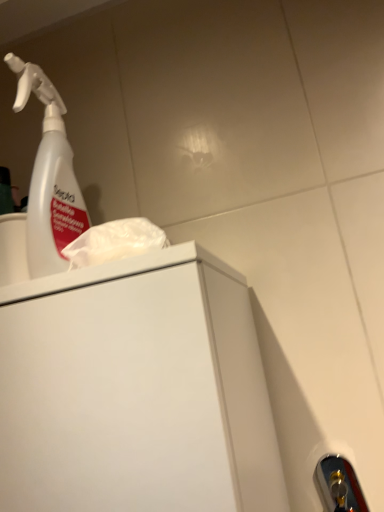
I want to click on gold metallic door handle at lower right, so click(339, 485).

What is the approximate height of gold metallic door handle at lower right?

gold metallic door handle at lower right is 7.75 inches tall.

What do you see at coordinates (339, 485) in the screenshot?
I see `gold metallic door handle at lower right` at bounding box center [339, 485].

What do you see at coordinates (49, 177) in the screenshot?
I see `transparent plastic spray bottle at upper left` at bounding box center [49, 177].

This screenshot has height=512, width=384. In order to click on transparent plastic spray bottle at upper left in this screenshot , I will do `click(49, 177)`.

The height and width of the screenshot is (512, 384). Find the location of `gold metallic door handle at lower right`. gold metallic door handle at lower right is located at coordinates (339, 485).

Would you say gold metallic door handle at lower right is to the left or to the right of transparent plastic spray bottle at upper left in the picture?

gold metallic door handle at lower right is to the right of transparent plastic spray bottle at upper left.

Is gold metallic door handle at lower right further to the viewer compared to transparent plastic spray bottle at upper left?

Yes, it is.

Is point (347, 511) closer to camera compared to point (49, 250)?

No, (347, 511) is behind (49, 250).

From the image's perspective, is gold metallic door handle at lower right located beneath transparent plastic spray bottle at upper left?

Yes.

From a real-world perspective, who is located lower, gold metallic door handle at lower right or transparent plastic spray bottle at upper left?

gold metallic door handle at lower right.

Can you confirm if gold metallic door handle at lower right is thinner than transparent plastic spray bottle at upper left?

Correct, the width of gold metallic door handle at lower right is less than that of transparent plastic spray bottle at upper left.

Looking at this image, who is taller, gold metallic door handle at lower right or transparent plastic spray bottle at upper left?

transparent plastic spray bottle at upper left is taller.

Considering the relative sizes of gold metallic door handle at lower right and transparent plastic spray bottle at upper left in the image provided, is gold metallic door handle at lower right smaller than transparent plastic spray bottle at upper left?

Yes.

Consider the image. Is gold metallic door handle at lower right completely or partially outside of transparent plastic spray bottle at upper left?

Yes.

Is gold metallic door handle at lower right touching transparent plastic spray bottle at upper left?

No, gold metallic door handle at lower right is not touching transparent plastic spray bottle at upper left.

Is gold metallic door handle at lower right facing towards transparent plastic spray bottle at upper left?

No, gold metallic door handle at lower right is not oriented towards transparent plastic spray bottle at upper left.

How different are the orientations of gold metallic door handle at lower right and transparent plastic spray bottle at upper left in degrees?

There is a 0.0015-degree angle between the facing directions of gold metallic door handle at lower right and transparent plastic spray bottle at upper left.

How far apart are gold metallic door handle at lower right and transparent plastic spray bottle at upper left?

They are 21.81 inches apart.

At what (x,y) coordinates should I click in order to perform the action: click on door handle lying below the transparent plastic spray bottle at upper left (from the image's perspective). Please return your answer as a coordinate pair (x, y). Image resolution: width=384 pixels, height=512 pixels. Looking at the image, I should click on (339, 485).

Is transparent plastic spray bottle at upper left to the right of gold metallic door handle at lower right from the viewer's perspective?

In fact, transparent plastic spray bottle at upper left is to the left of gold metallic door handle at lower right.

Which object is closer to the camera taking this photo, transparent plastic spray bottle at upper left or gold metallic door handle at lower right?

transparent plastic spray bottle at upper left is closer to the camera.

Does point (32, 183) appear closer or farther from the camera than point (319, 467)?

Point (32, 183) is closer to the camera than point (319, 467).

From the image's perspective, is transparent plastic spray bottle at upper left below gold metallic door handle at lower right?

Incorrect, from the image's perspective, transparent plastic spray bottle at upper left is higher than gold metallic door handle at lower right.

From the picture: From a real-world perspective, is transparent plastic spray bottle at upper left positioned above or below gold metallic door handle at lower right?

transparent plastic spray bottle at upper left is above gold metallic door handle at lower right.

Considering the sizes of objects transparent plastic spray bottle at upper left and gold metallic door handle at lower right in the image provided, who is wider, transparent plastic spray bottle at upper left or gold metallic door handle at lower right?

With larger width is transparent plastic spray bottle at upper left.

Between transparent plastic spray bottle at upper left and gold metallic door handle at lower right, which one has more height?

Standing taller between the two is transparent plastic spray bottle at upper left.

Which of these two, transparent plastic spray bottle at upper left or gold metallic door handle at lower right, is smaller?

gold metallic door handle at lower right.

Does transparent plastic spray bottle at upper left contain gold metallic door handle at lower right?

No, gold metallic door handle at lower right is not inside transparent plastic spray bottle at upper left.

In the scene shown: Is transparent plastic spray bottle at upper left not near gold metallic door handle at lower right?

No, transparent plastic spray bottle at upper left is not far from gold metallic door handle at lower right.

Is transparent plastic spray bottle at upper left facing away from gold metallic door handle at lower right?

transparent plastic spray bottle at upper left is not turned away from gold metallic door handle at lower right.

What's the angular difference between transparent plastic spray bottle at upper left and gold metallic door handle at lower right's facing directions?

0.0015 degrees.

Where is `door handle behind the transparent plastic spray bottle at upper left`? The height and width of the screenshot is (512, 384). door handle behind the transparent plastic spray bottle at upper left is located at coordinates (339, 485).

Locate an element on the screen. cleaning product on the left side of gold metallic door handle at lower right is located at coordinates click(x=49, y=177).

Where is `cleaning product in front of the gold metallic door handle at lower right`? Image resolution: width=384 pixels, height=512 pixels. cleaning product in front of the gold metallic door handle at lower right is located at coordinates (49, 177).